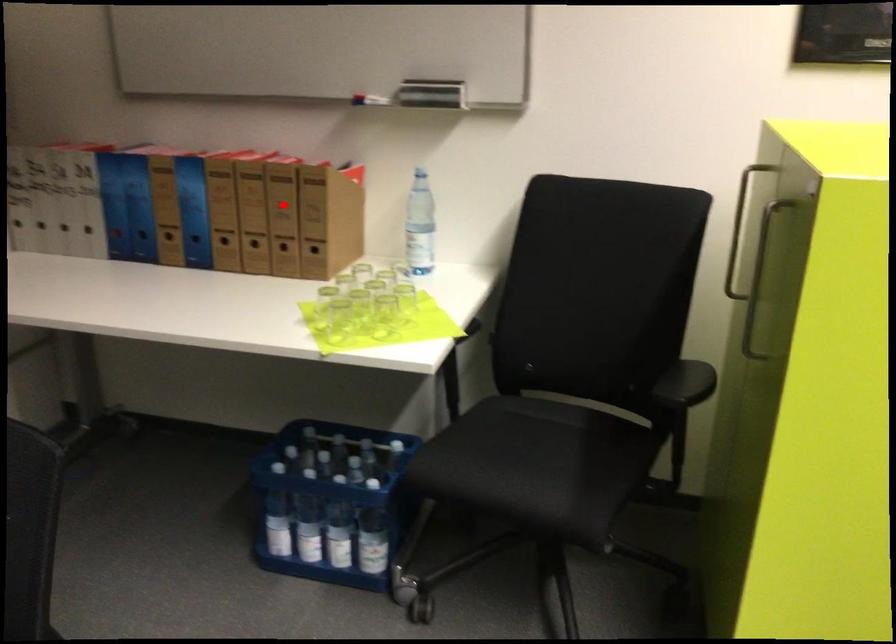
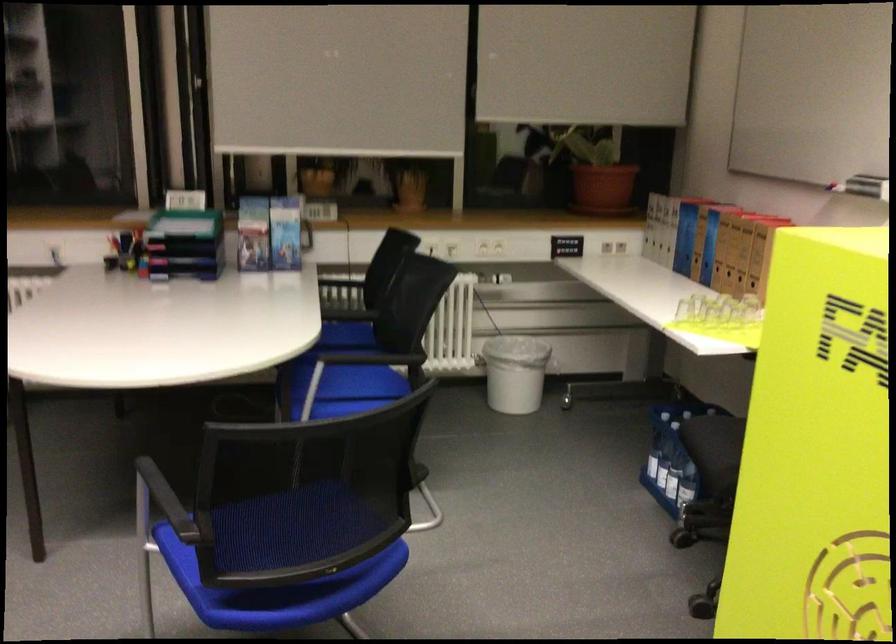
Question: I am providing you with two images of the same scene from different viewpoints. A red point is shown in image1. For the corresponding object point in image2, is it positioned nearer or farther from the camera?

Choices:
 (A) Nearer
 (B) Farther

Answer: (B)